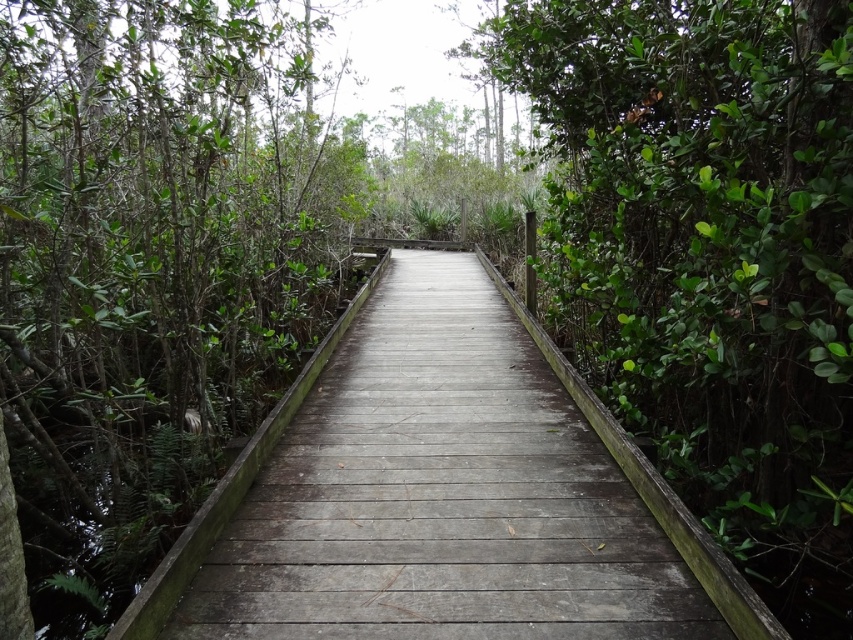
Does green leafy tree at left have a greater height compared to weathered wood bridge at center?

Indeed, green leafy tree at left has a greater height compared to weathered wood bridge at center.

Locate an element on the screen. green leafy tree at left is located at coordinates (152, 268).

This screenshot has height=640, width=853. I want to click on green leafy tree at left, so click(x=152, y=268).

Does green leafy tree at left appear on the right side of green leafy bush at right?

Incorrect, green leafy tree at left is not on the right side of green leafy bush at right.

Image resolution: width=853 pixels, height=640 pixels. I want to click on green leafy tree at left, so click(152, 268).

Is point (16, 17) positioned after point (619, 321)?

That is False.

This screenshot has width=853, height=640. What are the coordinates of `green leafy tree at left` in the screenshot? It's located at (152, 268).

Is green leafy bush at right to the left of weathered wood bridge at center from the viewer's perspective?

No, green leafy bush at right is not to the left of weathered wood bridge at center.

Does point (647, 396) lie in front of point (285, 573)?

No, it is behind (285, 573).

Identify the location of green leafy bush at right. (706, 244).